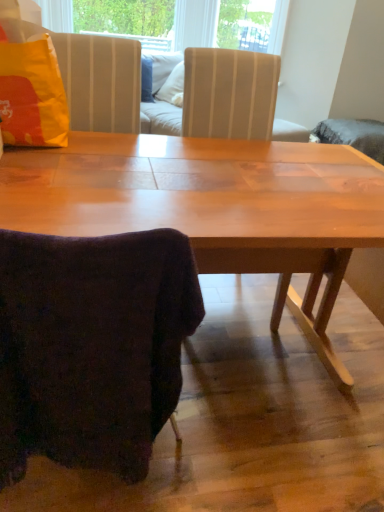
Image resolution: width=384 pixels, height=512 pixels. What do you see at coordinates (92, 346) in the screenshot?
I see `velvety dark purple chair at lower left` at bounding box center [92, 346].

The width and height of the screenshot is (384, 512). I want to click on velvety dark purple chair at lower left, so pyautogui.click(x=92, y=346).

What do you see at coordinates (32, 95) in the screenshot? I see `matte yellow pillow at upper left` at bounding box center [32, 95].

Locate an element on the screen. This screenshot has width=384, height=512. matte yellow pillow at upper left is located at coordinates (32, 95).

Image resolution: width=384 pixels, height=512 pixels. I want to click on velvety dark purple chair at lower left, so click(x=92, y=346).

Considering the relative positions of velvety dark purple chair at lower left and matte yellow pillow at upper left in the image provided, is velvety dark purple chair at lower left to the right of matte yellow pillow at upper left from the viewer's perspective?

Yes.

Is velvety dark purple chair at lower left positioned before matte yellow pillow at upper left?

Yes, it is.

Is point (108, 274) closer to viewer compared to point (31, 101)?

Yes, it is in front of point (31, 101).

From the image's perspective, does velvety dark purple chair at lower left appear higher than matte yellow pillow at upper left?

No, from the image's perspective, velvety dark purple chair at lower left is not over matte yellow pillow at upper left.

From a real-world perspective, which object stands above the other?

matte yellow pillow at upper left, from a real-world perspective.

Is velvety dark purple chair at lower left thinner than matte yellow pillow at upper left?

No, velvety dark purple chair at lower left is not thinner than matte yellow pillow at upper left.

Considering the sizes of objects velvety dark purple chair at lower left and matte yellow pillow at upper left in the image provided, who is taller, velvety dark purple chair at lower left or matte yellow pillow at upper left?

velvety dark purple chair at lower left is taller.

Between velvety dark purple chair at lower left and matte yellow pillow at upper left, which one has larger size?

velvety dark purple chair at lower left is bigger.

Is velvety dark purple chair at lower left located outside matte yellow pillow at upper left?

Yes, velvety dark purple chair at lower left is not within matte yellow pillow at upper left.

Is velvety dark purple chair at lower left far away from matte yellow pillow at upper left?

No, velvety dark purple chair at lower left is in close proximity to matte yellow pillow at upper left.

Does velvety dark purple chair at lower left turn towards matte yellow pillow at upper left?

Yes, velvety dark purple chair at lower left is turned towards matte yellow pillow at upper left.

How distant is velvety dark purple chair at lower left from matte yellow pillow at upper left?

31.87 inches.

Locate an element on the screen. The width and height of the screenshot is (384, 512). pillow on the left of velvety dark purple chair at lower left is located at coordinates (32, 95).

Which is more to the right, matte yellow pillow at upper left or velvety dark purple chair at lower left?

velvety dark purple chair at lower left.

Is the depth of matte yellow pillow at upper left greater than that of velvety dark purple chair at lower left?

Yes, matte yellow pillow at upper left is further from the viewer.

Does point (43, 120) lie behind point (149, 271)?

Yes, it is behind point (149, 271).

From the image's perspective, which one is positioned higher, matte yellow pillow at upper left or velvety dark purple chair at lower left?

matte yellow pillow at upper left, from the image's perspective.

From a real-world perspective, is matte yellow pillow at upper left positioned above or below velvety dark purple chair at lower left?

From a real-world perspective, matte yellow pillow at upper left is physically above velvety dark purple chair at lower left.

Looking at this image, which object is thinner, matte yellow pillow at upper left or velvety dark purple chair at lower left?

Thinner between the two is matte yellow pillow at upper left.

Considering the sizes of matte yellow pillow at upper left and velvety dark purple chair at lower left in the image, is matte yellow pillow at upper left taller or shorter than velvety dark purple chair at lower left?

Clearly, matte yellow pillow at upper left is shorter compared to velvety dark purple chair at lower left.

Looking at the image, does matte yellow pillow at upper left seem bigger or smaller compared to velvety dark purple chair at lower left?

Considering their sizes, matte yellow pillow at upper left takes up less space than velvety dark purple chair at lower left.

Consider the image. Is velvety dark purple chair at lower left located within matte yellow pillow at upper left?

That's incorrect, velvety dark purple chair at lower left is not inside matte yellow pillow at upper left.

Are matte yellow pillow at upper left and velvety dark purple chair at lower left located far from each other?

No, matte yellow pillow at upper left is in close proximity to velvety dark purple chair at lower left.

In the scene shown: Could you tell me if matte yellow pillow at upper left is facing velvety dark purple chair at lower left?

No, matte yellow pillow at upper left is not oriented towards velvety dark purple chair at lower left.

In the image, there is a velvety dark purple chair at lower left. Find the location of `pillow above it (from the image's perspective)`. pillow above it (from the image's perspective) is located at coordinates (32, 95).

Where is `chair directly beneath the matte yellow pillow at upper left (from a real-world perspective)`? The width and height of the screenshot is (384, 512). chair directly beneath the matte yellow pillow at upper left (from a real-world perspective) is located at coordinates (92, 346).

Where is `chair in front of the matte yellow pillow at upper left`? The width and height of the screenshot is (384, 512). chair in front of the matte yellow pillow at upper left is located at coordinates (92, 346).